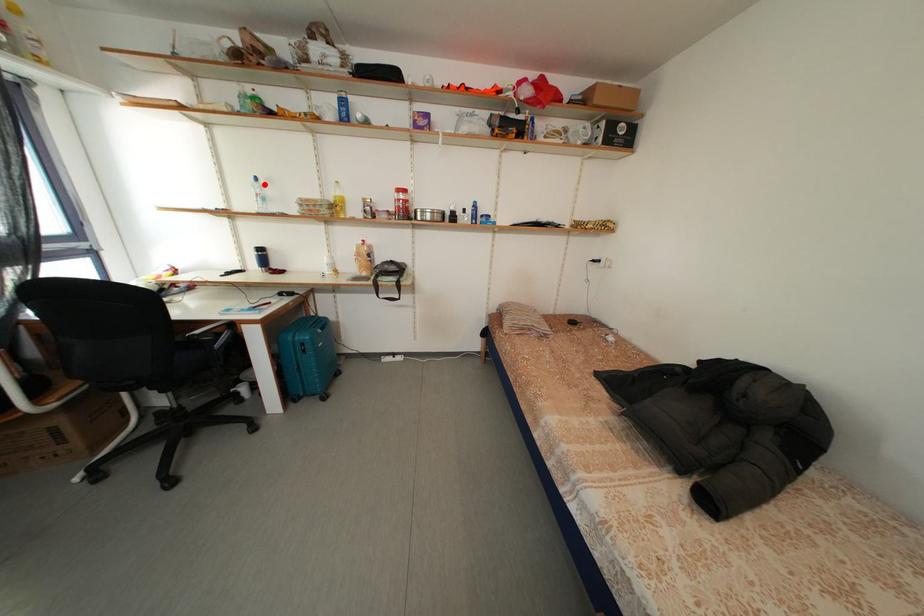
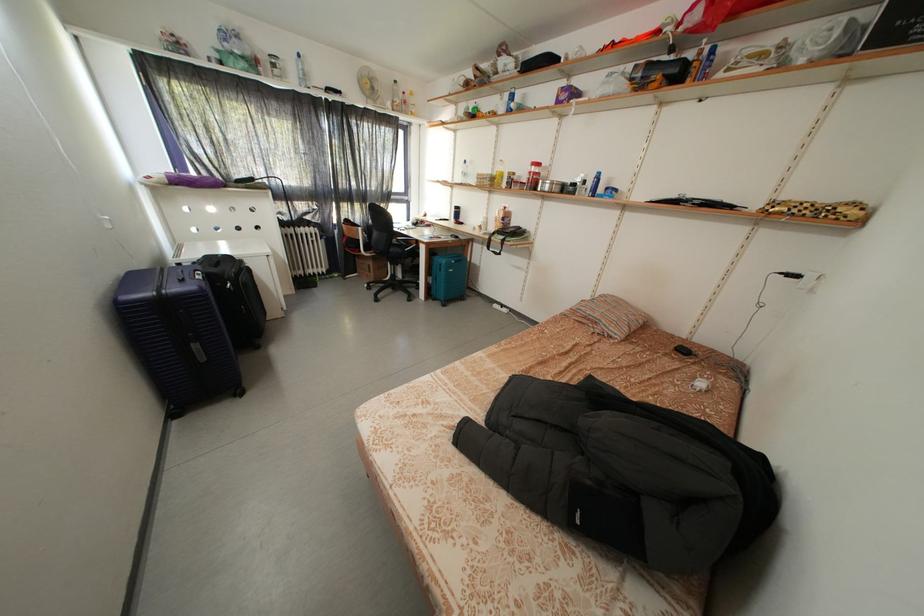
Where in the second image is the point corresponding to the highlighted location from the first image?

(472, 167)